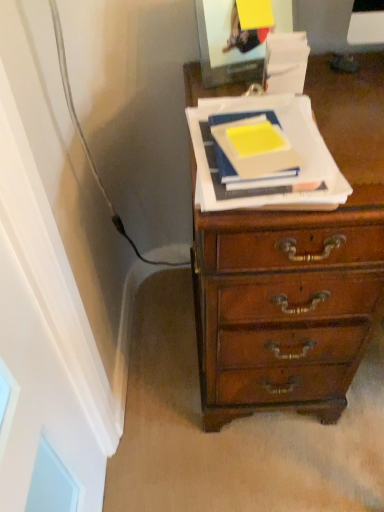
Question: Is yellow matte paper at center, the 2th paperback book from the right, spatially inside yellow matte paper at center, placed as the first paperback book when sorted from right to left, or outside of it?

Choices:
 (A) outside
 (B) inside

Answer: (B)

Question: In terms of width, does yellow matte paper at center, the 2th paperback book from the right, look wider or thinner when compared to yellow matte paper at center, placed as the first paperback book when sorted from right to left?

Choices:
 (A) thin
 (B) wide

Answer: (A)

Question: Based on their sizes in the image, would you say yellow matte paper at center, which appears as the first paperback book when viewed from the left, is bigger or smaller than yellow matte paper at center, placed as the first paperback book when sorted from right to left?

Choices:
 (A) big
 (B) small

Answer: (B)

Question: Based on their sizes in the image, would you say yellow matte paper at center, the second paperback book in the left-to-right sequence, is bigger or smaller than yellow matte paper at center, the 2th paperback book from the right?

Choices:
 (A) small
 (B) big

Answer: (B)

Question: Based on their positions, is yellow matte paper at center, placed as the first paperback book when sorted from right to left, located to the left or right of yellow matte paper at center, which appears as the first paperback book when viewed from the left?

Choices:
 (A) right
 (B) left

Answer: (A)

Question: From the image's perspective, is yellow matte paper at center, placed as the first paperback book when sorted from right to left, positioned above or below yellow matte paper at center, which appears as the first paperback book when viewed from the left?

Choices:
 (A) below
 (B) above

Answer: (A)

Question: In terms of width, does yellow matte paper at center, the second paperback book in the left-to-right sequence, look wider or thinner when compared to yellow matte paper at center, the 2th paperback book from the right?

Choices:
 (A) thin
 (B) wide

Answer: (B)